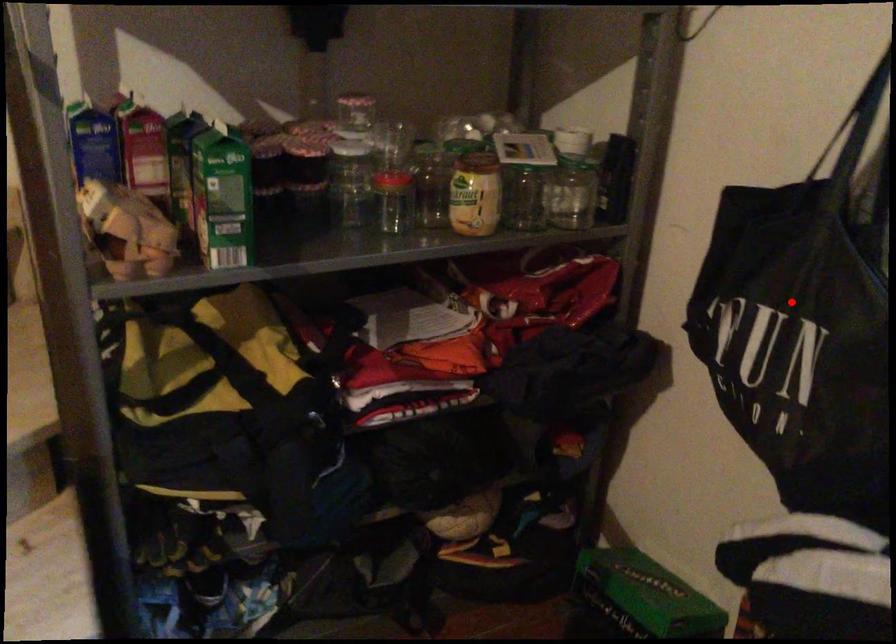
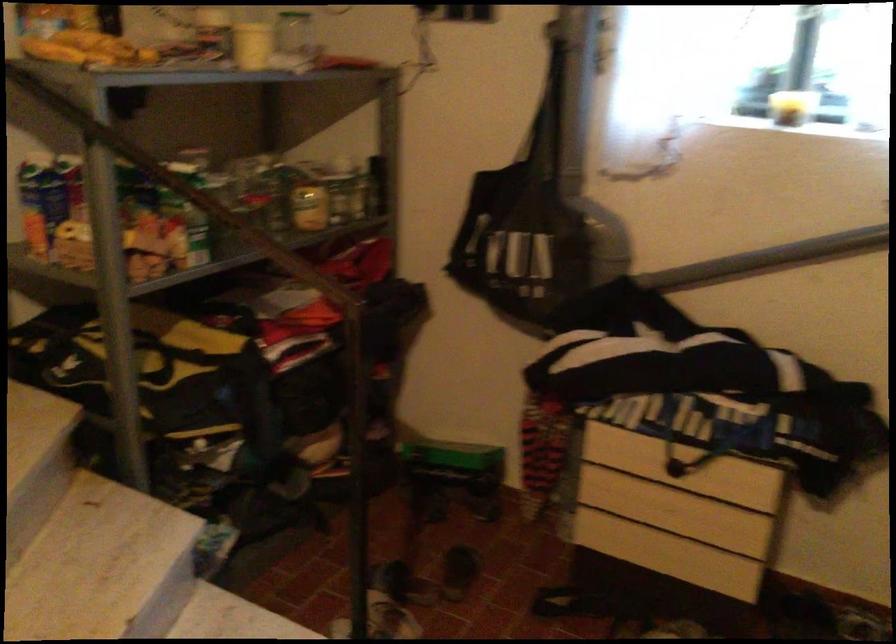
Where in the second image is the point corresponding to the highlighted location from the first image?

(526, 223)